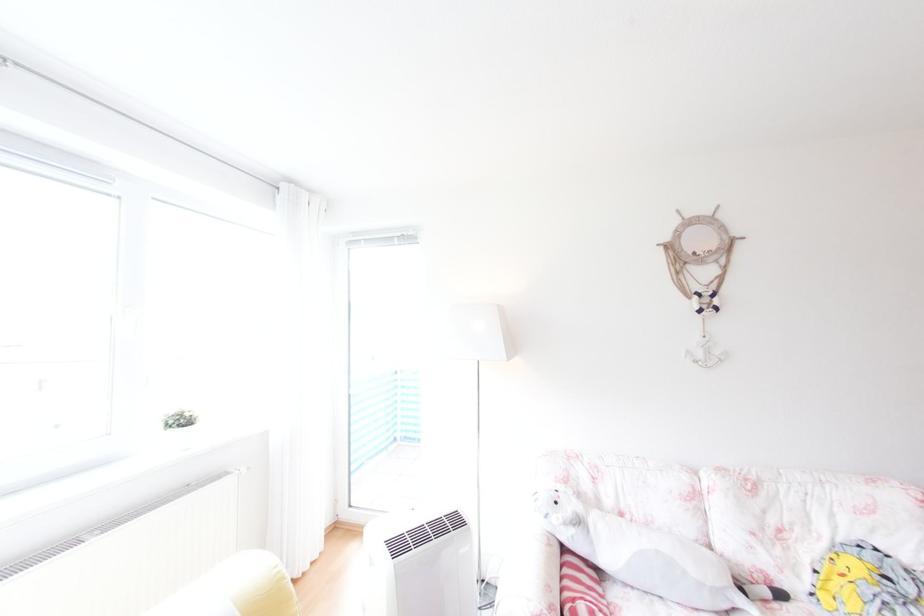
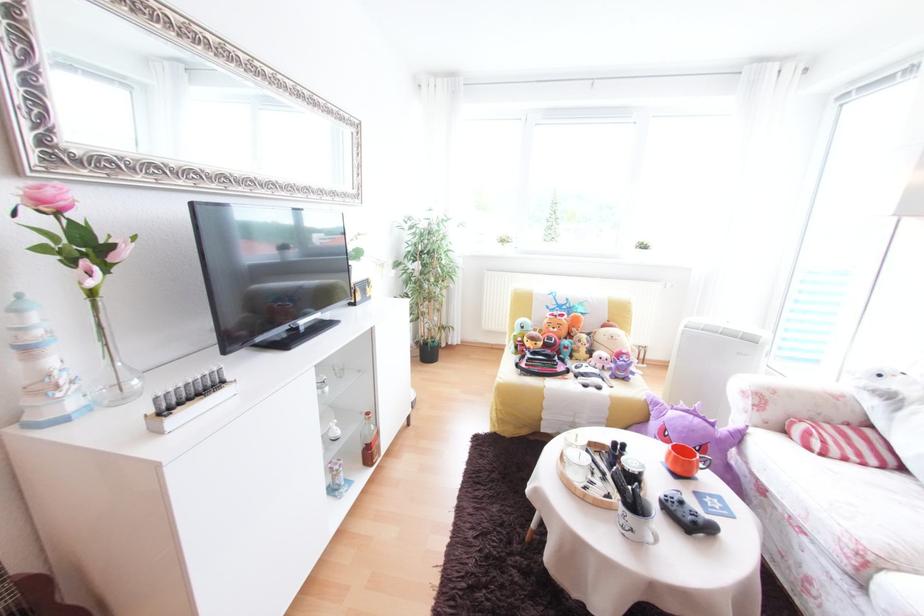
The point at (613, 584) is marked in the first image. Where is the corresponding point in the second image?

(907, 472)